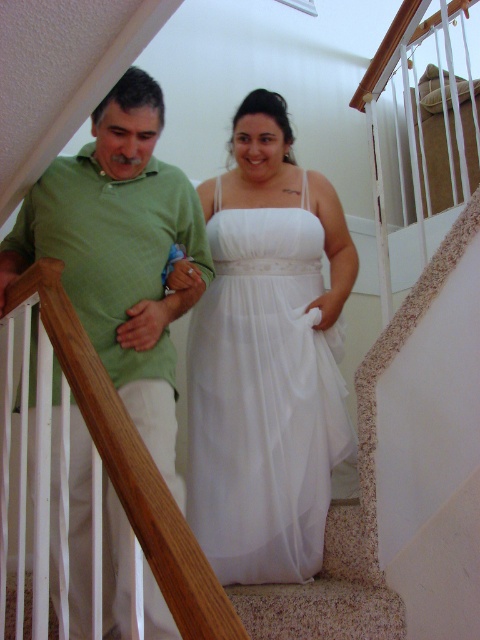
Is white chiffon dress at center to the left of green matte shirt at left from the viewer's perspective?

Incorrect, white chiffon dress at center is not on the left side of green matte shirt at left.

Between white chiffon dress at center and green matte shirt at left, which one appears on the right side from the viewer's perspective?

white chiffon dress at center

Between point (252, 397) and point (104, 280), which one is positioned in front?

Positioned in front is point (104, 280).

You are a GUI agent. You are given a task and a screenshot of the screen. Output one action in this format:
    pyautogui.click(x=<x>, y=<y>)
    Task: Click on the white chiffon dress at center
    This screenshot has height=640, width=480.
    Given the screenshot: What is the action you would take?
    pyautogui.click(x=266, y=356)